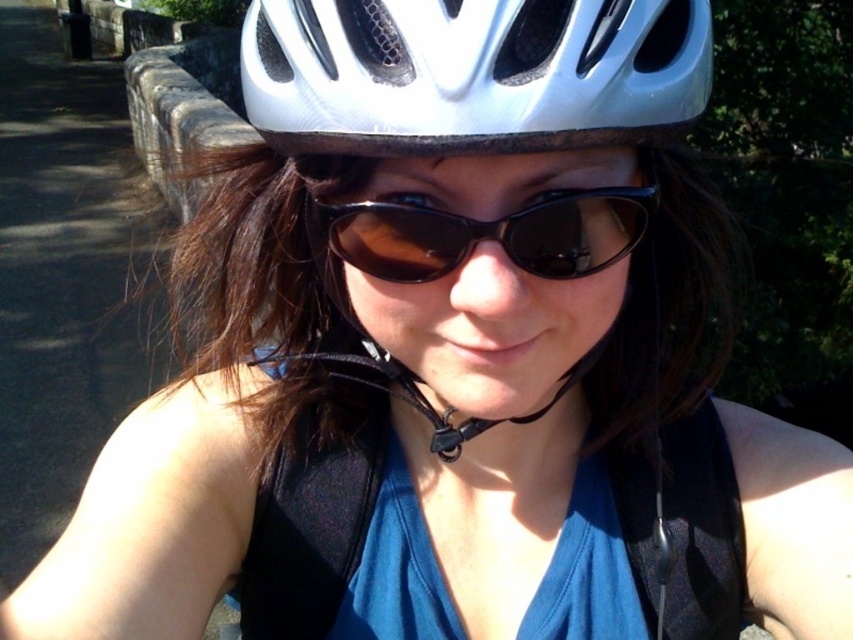
You are a personal trainer assessing the cyclist. You need to ensure the distance between the black fabric vest at center and the brown matte sunglasses at center is at least 10 inches to allow proper movement. Is the current distance sufficient?

The black fabric vest at center and brown matte sunglasses at center are 8.16 inches apart from each other, which is less than the required 10 inches. The current distance is insufficient for proper movement.

Wait, the objects list has two entries that are almost the same. The first is labeled as a white matte bicycle helmet at center, and the second is white matte helmet at center. The description says the first is smaller than the second. But how can there be two helmets in the same position? Maybe it was a mistake in the input. Let me check the rules again. The user provided the objects as listed, so I have to use them as given. The question must mention both objects exactly as in the objects list. The answer

The white matte bicycle helmet at center is smaller in size compared to the white matte helmet at center.

You are a cyclist wearing a white helmet and dark sunglasses. You notice two points in your path ahead. The first point is at coordinates point (636, 68) and the second is at point (247, 106). Which point should you aim for first if you want to follow the correct path?

You should aim for point (636, 68) first because it is in front of point (247, 106).